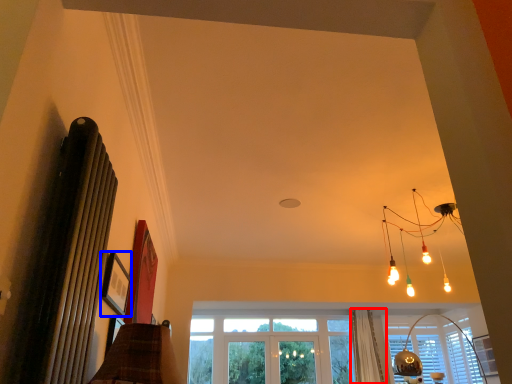
Question: Which object is further to the camera taking this photo, curtain (highlighted by a red box) or picture frame (highlighted by a blue box)?

Choices:
 (A) curtain
 (B) picture frame

Answer: (A)